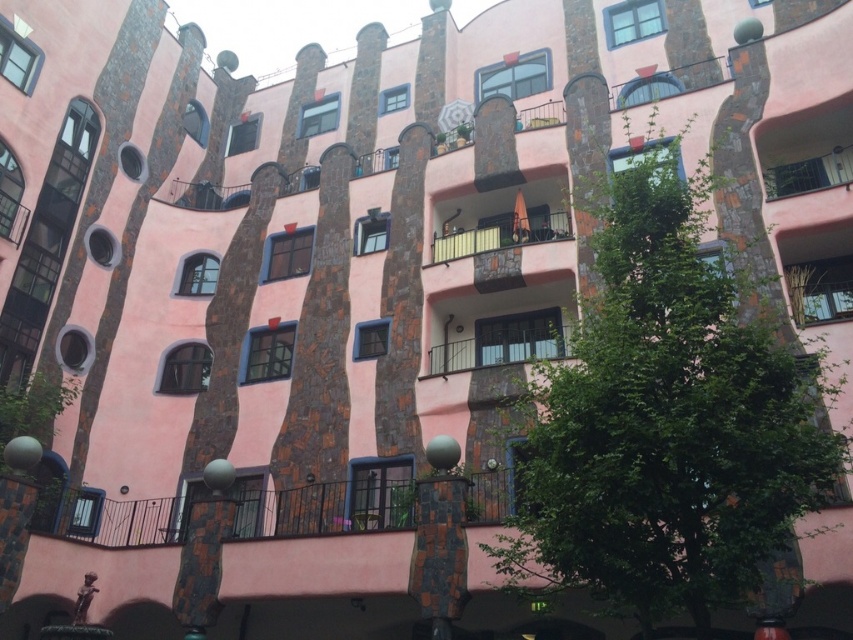
Question: Is black metal railing at center positioned in front of pink stone balcony at center?

Choices:
 (A) no
 (B) yes

Answer: (B)

Question: Is green leafy tree at center below black metal railing at center?

Choices:
 (A) no
 (B) yes

Answer: (A)

Question: Among these objects, which one is farthest from the camera?

Choices:
 (A) green leafy tree at center
 (B) pink stone balcony at center

Answer: (B)

Question: Which point appears farthest from the camera in this image?

Choices:
 (A) (505, 228)
 (B) (653, 243)

Answer: (A)

Question: Based on their relative distances, which object is farther from the black metal railing at center?

Choices:
 (A) green leafy tree at center
 (B) pink stone balcony at center

Answer: (A)

Question: Is black metal railing at center thinner than pink stone balcony at center?

Choices:
 (A) no
 (B) yes

Answer: (B)